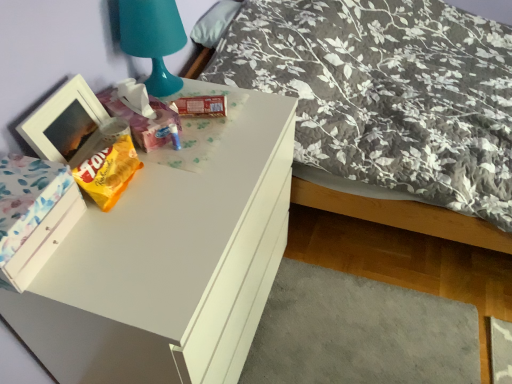
Identify the location of vacant area on top of white glossy desk at upper left (from a real-world perspective). (176, 181).